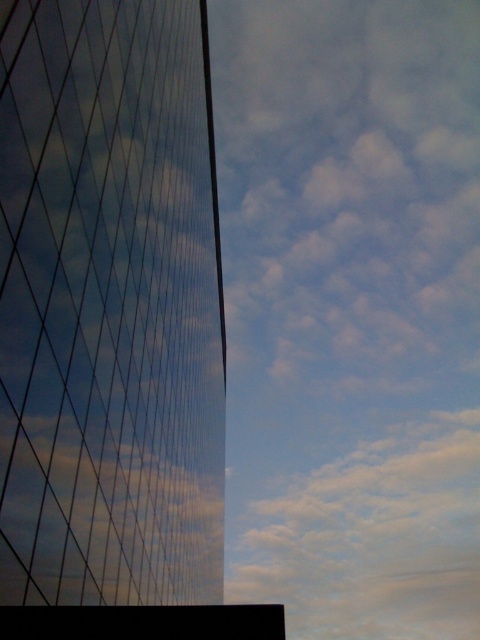
You are an architect designing a new building that needs to be wider than the existing reflective glass building at left. Based on the scene, can you determine if the white fluffy cloud at upper center can serve as a reference for the minimum width required?

The reflective glass building at left is narrower than the white fluffy cloud at upper center. Therefore, if your new building needs to be wider than the reflective glass building at left, the white fluffy cloud at upper center can serve as a reference for the minimum width required since it is wider than the building.

You are a drone operator who needs to fly a drone between the reflective glass building at left and the white fluffy cloud at upper center. The drone has a maximum flight distance of 1500 feet. Can the drone safely make this flight without exceeding its range?

Result: The reflective glass building at left and white fluffy cloud at upper center are 1707.09 feet apart from each other, which exceeds the drone maximum flight distance of 1500 feet. Therefore, the drone cannot safely make this flight without exceeding its range.